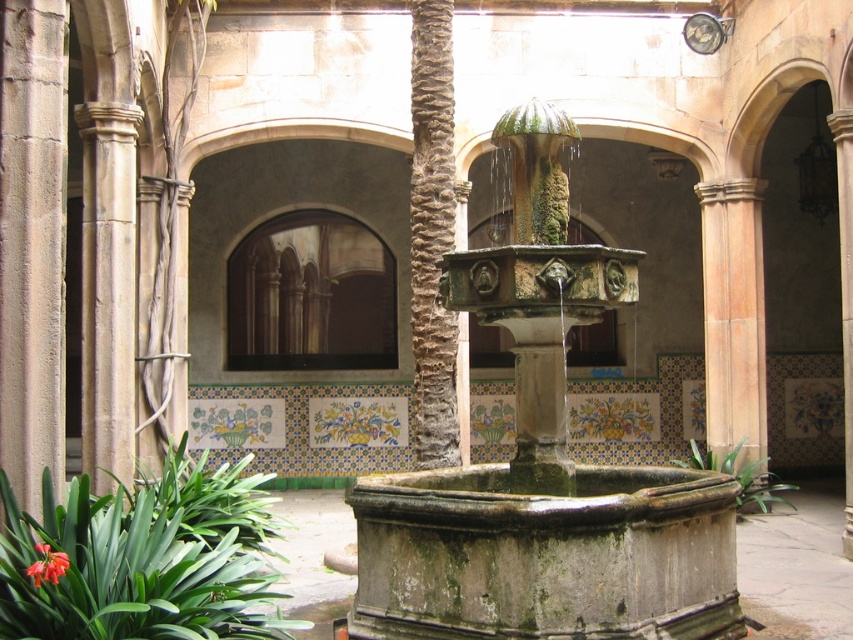
You are standing in the courtyard and want to locate the rough textured stone pillar at center. According to the coordinates provided, where should you look?

The rough textured stone pillar at center is located at point coordinates of (432, 236).

You are standing in the courtyard and want to place a small bench near the green leafy plant at center. Based on its coordinates, where should you position the bench to ensure it is closest to the plant?

The green leafy plant at center is located at coordinates point (x=741, y=476). To place the bench closest to the plant, position it near those coordinates.